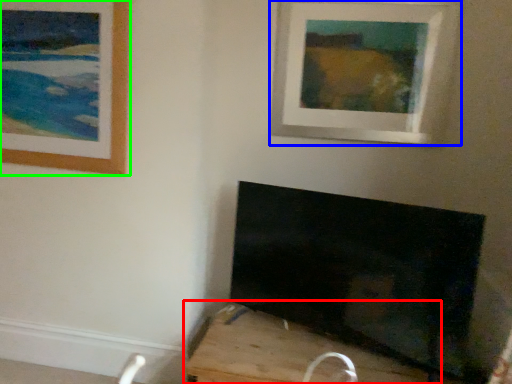
Question: Which object is the closest to the furniture (highlighted by a red box)? Choose among these: picture frame (highlighted by a blue box) or picture frame (highlighted by a green box).

Choices:
 (A) picture frame
 (B) picture frame

Answer: (B)